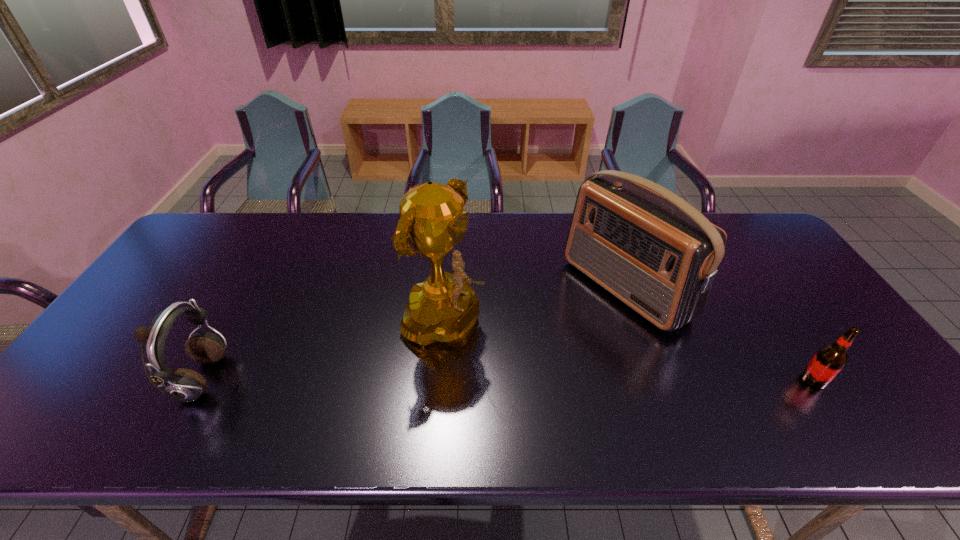
What are the coordinates of `free space on the desktop that is between the leftmost object and the rightmost object and is positioned on the front-facing side of the radio receiver` in the screenshot? It's located at (475, 380).

I want to click on vacant space on the desktop that is between the third tallest object and the shortest object and is positioned on the front side of the award, so tap(554, 380).